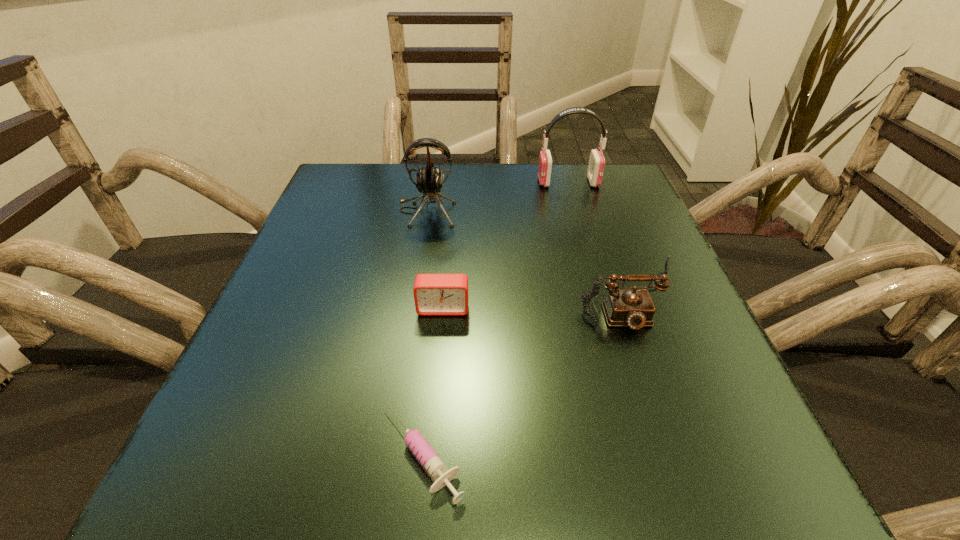
Locate an element on the screen. The height and width of the screenshot is (540, 960). vacant space located 0.070m on the outer surface of the right earphone is located at coordinates (510, 182).

Locate an element on the screen. The height and width of the screenshot is (540, 960). vacant space situated on the front of the second farthest object is located at coordinates (420, 249).

Locate an element on the screen. The width and height of the screenshot is (960, 540). vacant space situated 0.180m on the dial of the telephone is located at coordinates (685, 444).

You are a GUI agent. You are given a task and a screenshot of the screen. Output one action in this format:
    pyautogui.click(x=<x>, y=<y>)
    Task: Click on the vacant region located on the front-facing side of the alarm clock
    This screenshot has width=960, height=540.
    Given the screenshot: What is the action you would take?
    pyautogui.click(x=440, y=346)

You are a GUI agent. You are given a task and a screenshot of the screen. Output one action in this format:
    pyautogui.click(x=<x>, y=<y>)
    Task: Click on the vacant space located 0.180m on the back of the shortest object
    This screenshot has height=540, width=960.
    Given the screenshot: What is the action you would take?
    pyautogui.click(x=436, y=311)

This screenshot has width=960, height=540. In order to click on object that is at the near edge in this screenshot , I will do `click(432, 463)`.

The width and height of the screenshot is (960, 540). Identify the location of earphone that is at the right edge. (596, 165).

Locate an element on the screen. telephone that is positioned at the right edge is located at coordinates (633, 308).

The width and height of the screenshot is (960, 540). Identify the location of object situated at the far right corner. (596, 165).

Identify the location of vacant space at the far edge of the desktop. Image resolution: width=960 pixels, height=540 pixels. (529, 179).